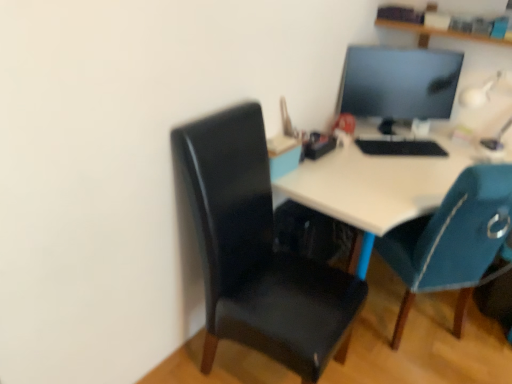
Question: Is white glossy table lamp at upper right bigger or smaller than matte black monitor at upper right?

Choices:
 (A) big
 (B) small

Answer: (B)

Question: From the image's perspective, is white glossy table lamp at upper right above or below matte black monitor at upper right?

Choices:
 (A) above
 (B) below

Answer: (B)

Question: Estimate the real-world distances between objects in this image. Which object is farther from the teal fabric chair at right, which is the second chair in left-to-right order?

Choices:
 (A) white glossy desk at center
 (B) matte black monitor at upper right
 (C) glossy black chair at center-left, the first chair viewed from the left
 (D) wooden shelf at upper center
 (E) white glossy table lamp at upper right

Answer: (D)

Question: Which object is positioned farthest from the white glossy table lamp at upper right?

Choices:
 (A) matte black monitor at upper right
 (B) white glossy desk at center
 (C) wooden shelf at upper center
 (D) teal fabric chair at right, which is counted as the first chair, starting from the right
 (E) glossy black chair at center-left, which is the 2th chair in right-to-left order

Answer: (E)